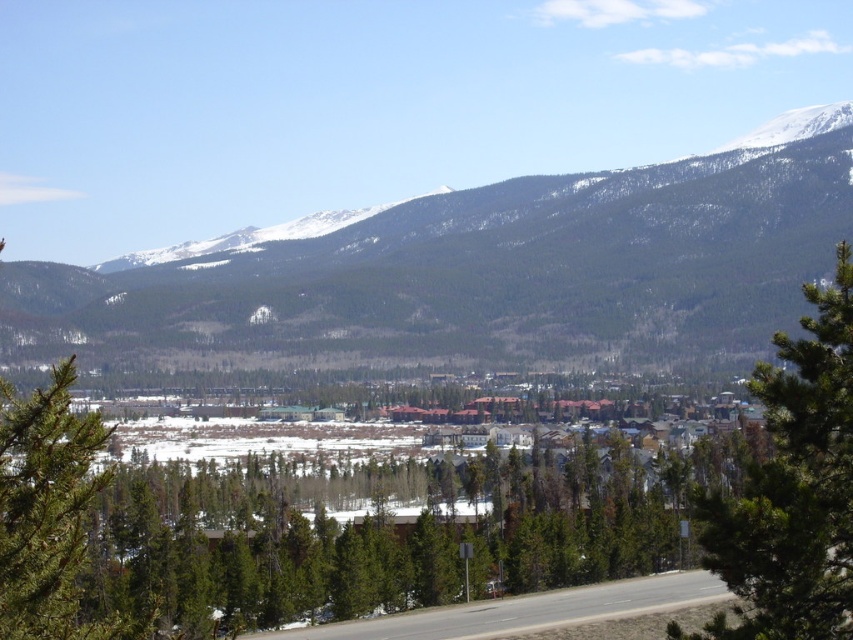
You are standing at the starting point of the road in the foreground and want to reach the highest point visible in the mountain range. Which of the two points, point [305,291] or point [440,632], is closer to your destination?

Point [440,632] is closer to the highest point in the mountain range because it is in front of point [305,291], which is further back in the scene.